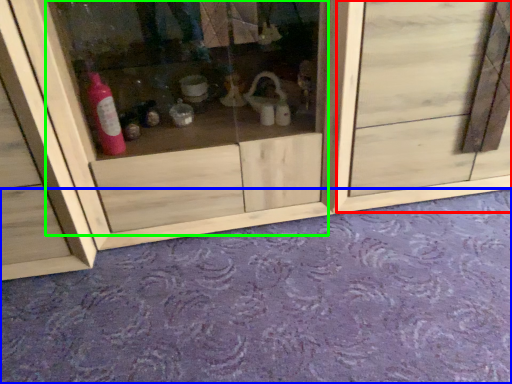
Question: Based on their relative distances, which object is farther from door (highlighted by a red box)? Choose from plain (highlighted by a blue box) and glass door (highlighted by a green box).

Choices:
 (A) plain
 (B) glass door

Answer: (A)